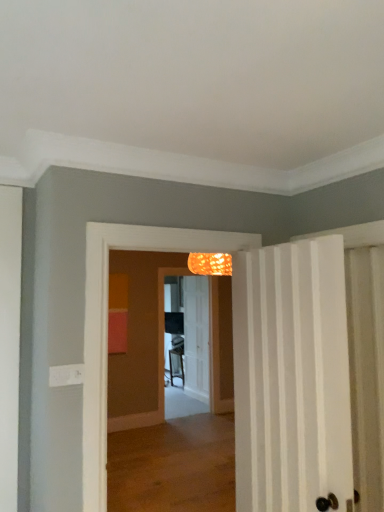
Where is `white textured door at center, the first door in the back-to-front sequence`? The height and width of the screenshot is (512, 384). white textured door at center, the first door in the back-to-front sequence is located at coordinates (196, 336).

At what (x,y) coordinates should I click in order to perform the action: click on white striped door at right, the 1th door positioned from the front. Please return your answer as a coordinate pair (x, y). This screenshot has width=384, height=512. Looking at the image, I should click on (291, 376).

In order to click on white textured door at center, which is counted as the second door, starting from the front in this screenshot , I will do `click(196, 336)`.

From the image's perspective, between white striped door at right, the 2th door in the back-to-front sequence, and white textured door at center, the first door in the back-to-front sequence, who is located below?

From the image's view, white textured door at center, the first door in the back-to-front sequence, is below.

Can you confirm if white striped door at right, the 2th door in the back-to-front sequence, is bigger than white textured door at center, which is counted as the second door, starting from the front?

Yes, white striped door at right, the 2th door in the back-to-front sequence, is bigger than white textured door at center, which is counted as the second door, starting from the front.

Between white striped door at right, the 2th door in the back-to-front sequence, and white textured door at center, which is counted as the second door, starting from the front, which one is positioned in front?

Positioned in front is white striped door at right, the 2th door in the back-to-front sequence.

In the scene shown: Does white striped door at right, the 2th door in the back-to-front sequence, touch white textured door at center, which is counted as the second door, starting from the front?

No, white striped door at right, the 2th door in the back-to-front sequence, is not with white textured door at center, which is counted as the second door, starting from the front.

Can you confirm if white striped door at right, the 2th door in the back-to-front sequence, is wider than translucent glass screen door at center?

Correct, the width of white striped door at right, the 2th door in the back-to-front sequence, exceeds that of translucent glass screen door at center.

Based on the photo, measure the distance from white striped door at right, the 1th door positioned from the front, to translucent glass screen door at center.

white striped door at right, the 1th door positioned from the front, is 4.46 meters away from translucent glass screen door at center.

From the image's perspective, is white striped door at right, the 1th door positioned from the front, located above or below translucent glass screen door at center?

Clearly, from the image's perspective, white striped door at right, the 1th door positioned from the front, is above translucent glass screen door at center.

At what (x,y) coordinates should I click in order to perform the action: click on door in front of the translucent glass screen door at center. Please return your answer as a coordinate pair (x, y). The image size is (384, 512). Looking at the image, I should click on (291, 376).

Which object is thinner, white textured door at center, which is counted as the second door, starting from the front, or white striped door at right, the 1th door positioned from the front?

With smaller width is white textured door at center, which is counted as the second door, starting from the front.

Do you think white textured door at center, the first door in the back-to-front sequence, is within white striped door at right, the 1th door positioned from the front, or outside of it?

white textured door at center, the first door in the back-to-front sequence, lies outside white striped door at right, the 1th door positioned from the front.

Does white textured door at center, the first door in the back-to-front sequence, turn towards white striped door at right, the 2th door in the back-to-front sequence?

No, white textured door at center, the first door in the back-to-front sequence, is not facing towards white striped door at right, the 2th door in the back-to-front sequence.

Who is taller, white textured door at center, the first door in the back-to-front sequence, or white striped door at right, the 2th door in the back-to-front sequence?

With more height is white textured door at center, the first door in the back-to-front sequence.

Which is in front, white textured door at center, which is counted as the second door, starting from the front, or translucent glass screen door at center?

translucent glass screen door at center is more forward.

This screenshot has height=512, width=384. In the image, there is a translucent glass screen door at center. In order to click on door below it (from a real-world perspective) in this screenshot , I will do 196,336.

From a real-world perspective, which is physically above, white textured door at center, the first door in the back-to-front sequence, or translucent glass screen door at center?

translucent glass screen door at center is physically above.

From a real-world perspective, which is physically below, translucent glass screen door at center or white striped door at right, the 1th door positioned from the front?

translucent glass screen door at center is physically lower.

The width and height of the screenshot is (384, 512). In order to click on the 2nd door to the right of the translucent glass screen door at center, counting from the anchor's position in this screenshot , I will do `click(291, 376)`.

Is white striped door at right, the 2th door in the back-to-front sequence, surrounded by translucent glass screen door at center?

That's incorrect, white striped door at right, the 2th door in the back-to-front sequence, is not inside translucent glass screen door at center.

From the image's perspective, is translucent glass screen door at center on white textured door at center, the first door in the back-to-front sequence?

Yes.

Would you say translucent glass screen door at center is outside white textured door at center, which is counted as the second door, starting from the front?

Yes, translucent glass screen door at center is outside of white textured door at center, which is counted as the second door, starting from the front.

From a real-world perspective, who is located higher, translucent glass screen door at center or white textured door at center, the first door in the back-to-front sequence?

In real-world perspective, translucent glass screen door at center is above.

Considering the sizes of objects translucent glass screen door at center and white textured door at center, which is counted as the second door, starting from the front, in the image provided, who is smaller, translucent glass screen door at center or white textured door at center, which is counted as the second door, starting from the front,?

white textured door at center, which is counted as the second door, starting from the front.

The width and height of the screenshot is (384, 512). I want to click on door in front of the white textured door at center, which is counted as the second door, starting from the front, so click(x=291, y=376).

Locate an element on the screen. The width and height of the screenshot is (384, 512). screen door to the left of white striped door at right, the 1th door positioned from the front is located at coordinates (199, 338).

Based on their spatial positions, is translucent glass screen door at center or white textured door at center, which is counted as the second door, starting from the front, closer to white striped door at right, the 2th door in the back-to-front sequence?

Among the two, translucent glass screen door at center is located nearer to white striped door at right, the 2th door in the back-to-front sequence.

Based on their spatial positions, is white striped door at right, the 2th door in the back-to-front sequence, or white textured door at center, the first door in the back-to-front sequence, further from translucent glass screen door at center?

The object further to translucent glass screen door at center is white striped door at right, the 2th door in the back-to-front sequence.

Considering their positions, is white striped door at right, the 2th door in the back-to-front sequence, positioned closer to white textured door at center, which is counted as the second door, starting from the front, than translucent glass screen door at center?

Based on the image, translucent glass screen door at center appears to be nearer to white textured door at center, which is counted as the second door, starting from the front.

Looking at this image, considering their positions, is translucent glass screen door at center positioned closer to white textured door at center, which is counted as the second door, starting from the front, than white striped door at right, the 2th door in the back-to-front sequence?

translucent glass screen door at center lies closer to white textured door at center, which is counted as the second door, starting from the front, than the other object.

Considering their positions, is white textured door at center, which is counted as the second door, starting from the front, positioned further to white striped door at right, the 2th door in the back-to-front sequence, than translucent glass screen door at center?

Based on the image, white textured door at center, which is counted as the second door, starting from the front, appears to be further to white striped door at right, the 2th door in the back-to-front sequence.

Looking at the image, which one is located closer to translucent glass screen door at center, white textured door at center, the first door in the back-to-front sequence, or white striped door at right, the 1th door positioned from the front?

white textured door at center, the first door in the back-to-front sequence, is closer to translucent glass screen door at center.

You are a GUI agent. You are given a task and a screenshot of the screen. Output one action in this format:
    pyautogui.click(x=<x>, y=<y>)
    Task: Click on the screen door positioned between white striped door at right, the 2th door in the back-to-front sequence, and white textured door at center, which is counted as the second door, starting from the front, from near to far
    
    Given the screenshot: What is the action you would take?
    pyautogui.click(x=199, y=338)